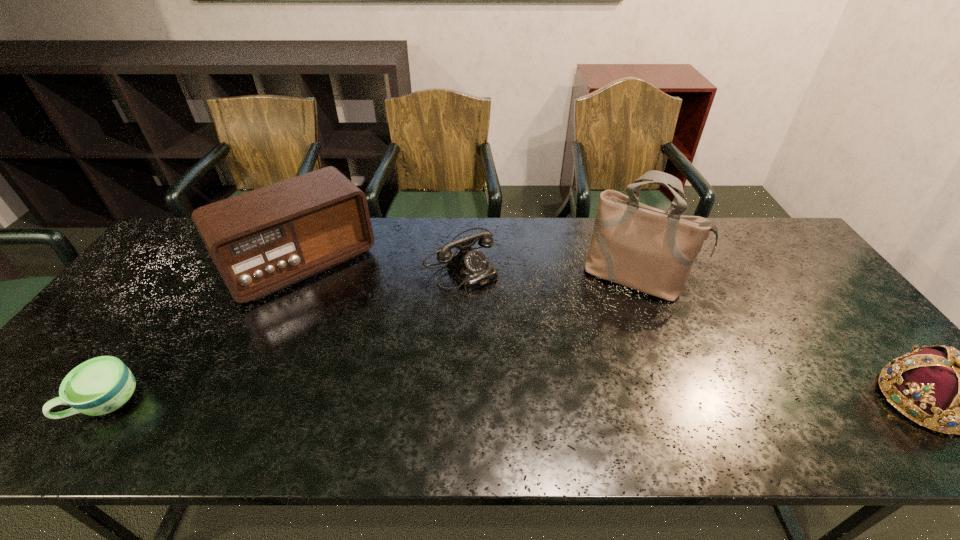
Find the location of `cup`. cup is located at coordinates (101, 385).

The image size is (960, 540). In order to click on the fourth shortest object in this screenshot , I will do `click(261, 241)`.

Locate an element on the screen. The image size is (960, 540). shoulder bag is located at coordinates (646, 249).

The width and height of the screenshot is (960, 540). What are the coordinates of `the fourth object from left to right` in the screenshot? It's located at (646, 249).

At what (x,y) coordinates should I click in order to perform the action: click on the fourth tallest object. Please return your answer as a coordinate pair (x, y). The width and height of the screenshot is (960, 540). Looking at the image, I should click on (470, 267).

Identify the location of the third object from left to right. (470, 267).

This screenshot has height=540, width=960. In order to click on free space located 0.110m on the back of the cup in this screenshot , I will do `click(152, 342)`.

Where is `vacant space situated on the front-facing side of the fourth shortest object`? The height and width of the screenshot is (540, 960). vacant space situated on the front-facing side of the fourth shortest object is located at coordinates (356, 329).

The height and width of the screenshot is (540, 960). What are the coordinates of `free space located 0.320m on the front-facing side of the fourth shortest object` in the screenshot? It's located at (391, 374).

What are the coordinates of `free space located 0.110m on the front-facing side of the fourth shortest object` in the screenshot? It's located at (350, 322).